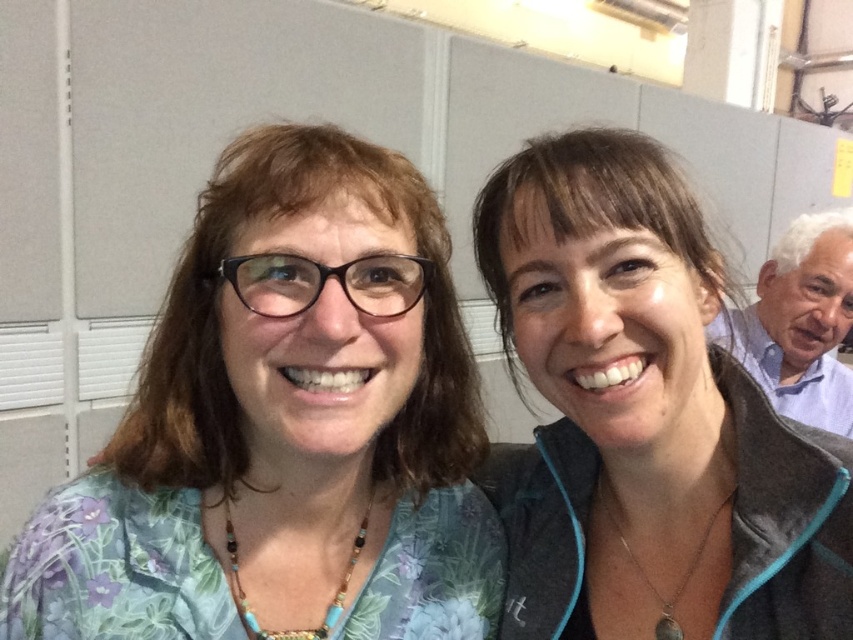
Question: Is floral fabric shirt at left wider than gray fleece jacket at upper right?

Choices:
 (A) no
 (B) yes

Answer: (B)

Question: Which object is closer to the camera taking this photo?

Choices:
 (A) blue shirt at right
 (B) floral fabric shirt at left
 (C) gray fleece jacket at upper right

Answer: (B)

Question: Is gray fleece jacket at upper right to the right of blue shirt at right from the viewer's perspective?

Choices:
 (A) no
 (B) yes

Answer: (A)

Question: Which object is positioned closest to the floral fabric shirt at left?

Choices:
 (A) gray fleece jacket at upper right
 (B) blue shirt at right

Answer: (A)

Question: Which of these objects is positioned closest to the blue shirt at right?

Choices:
 (A) floral fabric shirt at left
 (B) gray fleece jacket at upper right

Answer: (B)

Question: Does floral fabric shirt at left have a lesser width compared to gray fleece jacket at upper right?

Choices:
 (A) yes
 (B) no

Answer: (B)